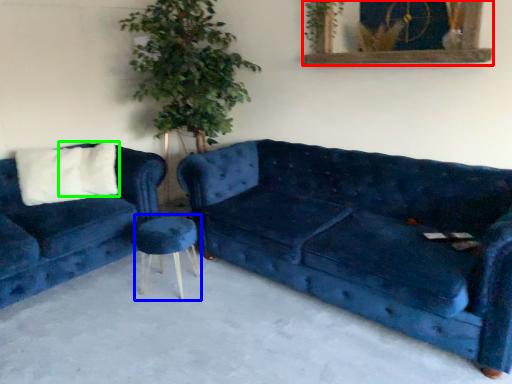
Question: Considering the real-world distances, which object is closest to picture frame (highlighted by a red box)? stool (highlighted by a blue box) or pillow (highlighted by a green box).

Choices:
 (A) stool
 (B) pillow

Answer: (A)